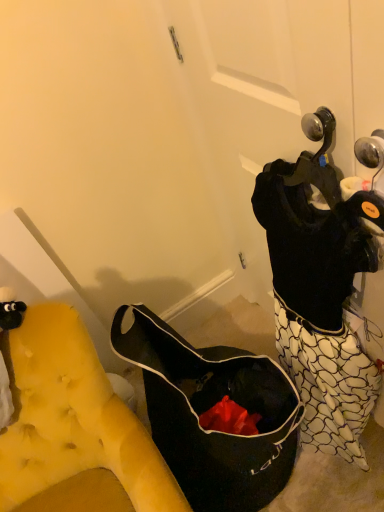
Describe the element at coordinates (73, 418) in the screenshot. The width and height of the screenshot is (384, 512). I see `yellow tufted fabric at left` at that location.

Locate an element on the screen. This screenshot has height=512, width=384. yellow tufted fabric at left is located at coordinates (73, 418).

What is the approximate height of yellow tufted fabric at left?

33.04 inches.

The width and height of the screenshot is (384, 512). What do you see at coordinates (209, 408) in the screenshot? I see `black fabric bag at lower left` at bounding box center [209, 408].

What is the approximate width of black fabric bag at lower left?

black fabric bag at lower left is 22.37 inches in width.

Locate an element on the screen. black fabric bag at lower left is located at coordinates (209, 408).

I want to click on yellow tufted fabric at left, so click(x=73, y=418).

Which object is positioned more to the left, black fabric bag at lower left or yellow tufted fabric at left?

Positioned to the left is yellow tufted fabric at left.

Between black fabric bag at lower left and yellow tufted fabric at left, which one is positioned behind?

black fabric bag at lower left is further away from the camera.

Between point (282, 467) and point (66, 374), which one is positioned in front?

The point (66, 374) is closer.

Looking at this image, from the image's perspective, is black fabric bag at lower left above or below yellow tufted fabric at left?

black fabric bag at lower left is situated higher than yellow tufted fabric at left in the image.

From a real-world perspective, between black fabric bag at lower left and yellow tufted fabric at left, who is vertically higher?

yellow tufted fabric at left, from a real-world perspective.

Which of these two, black fabric bag at lower left or yellow tufted fabric at left, is wider?

black fabric bag at lower left is wider.

Considering the sizes of objects black fabric bag at lower left and yellow tufted fabric at left in the image provided, who is shorter, black fabric bag at lower left or yellow tufted fabric at left?

black fabric bag at lower left.

Based on the photo, looking at the image, does black fabric bag at lower left seem bigger or smaller compared to yellow tufted fabric at left?

Considering their sizes, black fabric bag at lower left takes up less space than yellow tufted fabric at left.

Is yellow tufted fabric at left located within black fabric bag at lower left?

That's incorrect, yellow tufted fabric at left is not inside black fabric bag at lower left.

Is black fabric bag at lower left positioned far away from yellow tufted fabric at left?

No, black fabric bag at lower left is in close proximity to yellow tufted fabric at left.

Could you tell me if black fabric bag at lower left is facing yellow tufted fabric at left?

No, black fabric bag at lower left is not turned towards yellow tufted fabric at left.

The width and height of the screenshot is (384, 512). In order to click on handbag behind the yellow tufted fabric at left in this screenshot , I will do `click(209, 408)`.

Does yellow tufted fabric at left appear on the right side of black fabric bag at lower left?

No, yellow tufted fabric at left is not to the right of black fabric bag at lower left.

Between yellow tufted fabric at left and black fabric bag at lower left, which one is positioned behind?

Positioned behind is black fabric bag at lower left.

Does point (90, 392) appear closer or farther from the camera than point (179, 432)?

Point (90, 392) is positioned closer to the camera compared to point (179, 432).

From the image's perspective, is yellow tufted fabric at left located beneath black fabric bag at lower left?

Yes.

From a real-world perspective, is yellow tufted fabric at left located beneath black fabric bag at lower left?

No.

Consider the image. Is yellow tufted fabric at left thinner than black fabric bag at lower left?

Yes.

Can you confirm if yellow tufted fabric at left is taller than black fabric bag at lower left?

Yes.

Which of these two, yellow tufted fabric at left or black fabric bag at lower left, is smaller?

black fabric bag at lower left is smaller.

Does yellow tufted fabric at left contain black fabric bag at lower left?

Actually, black fabric bag at lower left is outside yellow tufted fabric at left.

In the scene shown: Is yellow tufted fabric at left directly adjacent to black fabric bag at lower left?

No, yellow tufted fabric at left is not with black fabric bag at lower left.

Is yellow tufted fabric at left oriented away from black fabric bag at lower left?

No, yellow tufted fabric at left is not facing away from black fabric bag at lower left.

Identify the location of furniture on the left of black fabric bag at lower left. This screenshot has height=512, width=384. (73, 418).

Locate an element on the screen. The image size is (384, 512). furniture below the black fabric bag at lower left (from the image's perspective) is located at coordinates (73, 418).

Identify the location of handbag that appears on the right of yellow tufted fabric at left. This screenshot has width=384, height=512. (209, 408).